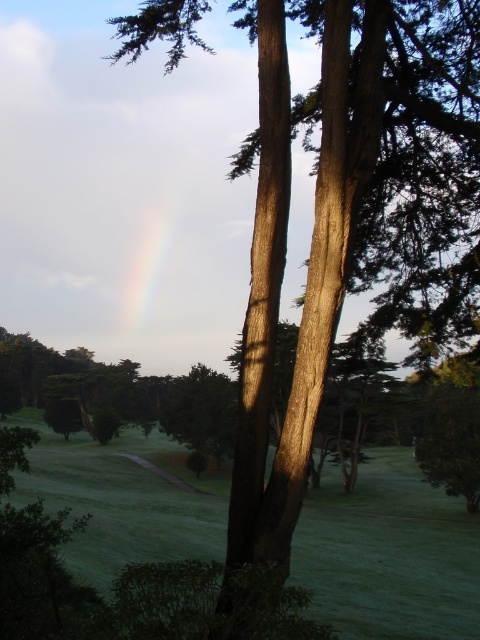
You are a hiker standing at the bottom left of the path. You want to walk towards the green matte tree at center. Which direction should you turn to avoid stepping on the green grass at center?

The green grass at center is on the right side of the green matte tree at center. To avoid stepping on the green grass at center, you should turn left towards the green matte tree at center.

You are a hiker trying to cross the area between the green grass at center and the green matte tree at center. Which one covers more ground in this area?

The green grass at center has a larger size compared to the green matte tree at center, so it covers more ground in this area.